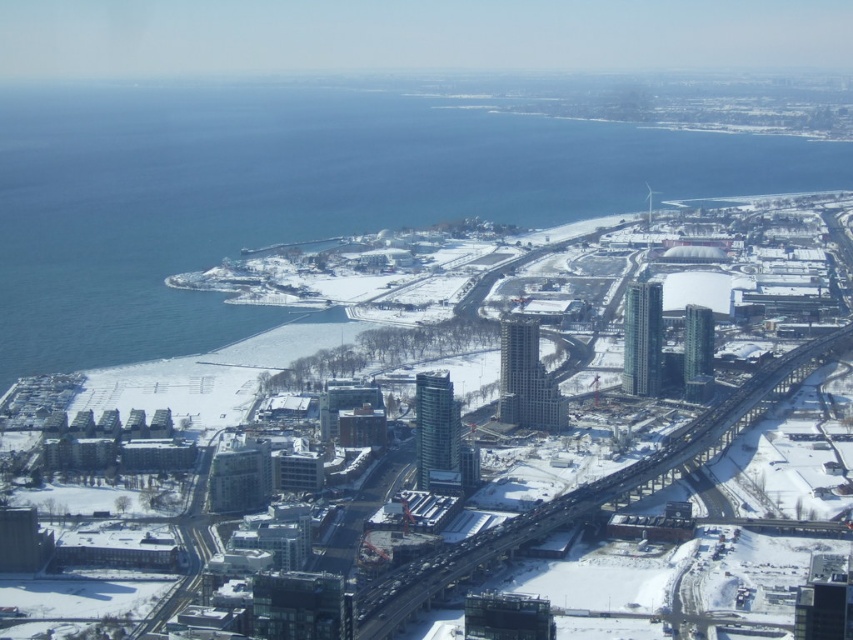
Question: Is white matte snow at center below blue water at lower left?

Choices:
 (A) no
 (B) yes

Answer: (B)

Question: Does white matte snow at center come behind blue water at lower left?

Choices:
 (A) yes
 (B) no

Answer: (B)

Question: Which point is closer to the camera?

Choices:
 (A) white matte snow at center
 (B) blue water at lower left

Answer: (A)

Question: Which point appears farthest from the camera in this image?

Choices:
 (A) (318, 488)
 (B) (4, 212)

Answer: (B)

Question: Which of the following is the closest to the observer?

Choices:
 (A) (137, 264)
 (B) (440, 540)

Answer: (B)

Question: Is white matte snow at center bigger than blue water at lower left?

Choices:
 (A) yes
 (B) no

Answer: (A)